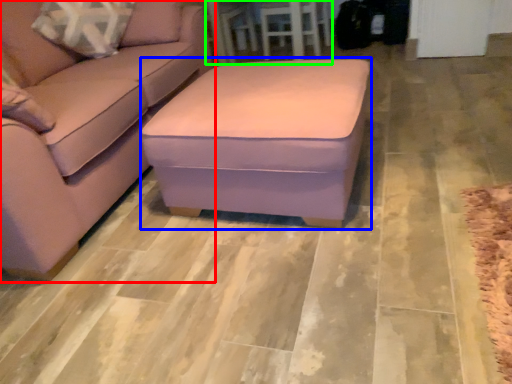
Question: Which is nearer to the studio couch (highlighted by a red box)? stool (highlighted by a blue box) or table (highlighted by a green box).

Choices:
 (A) stool
 (B) table

Answer: (A)